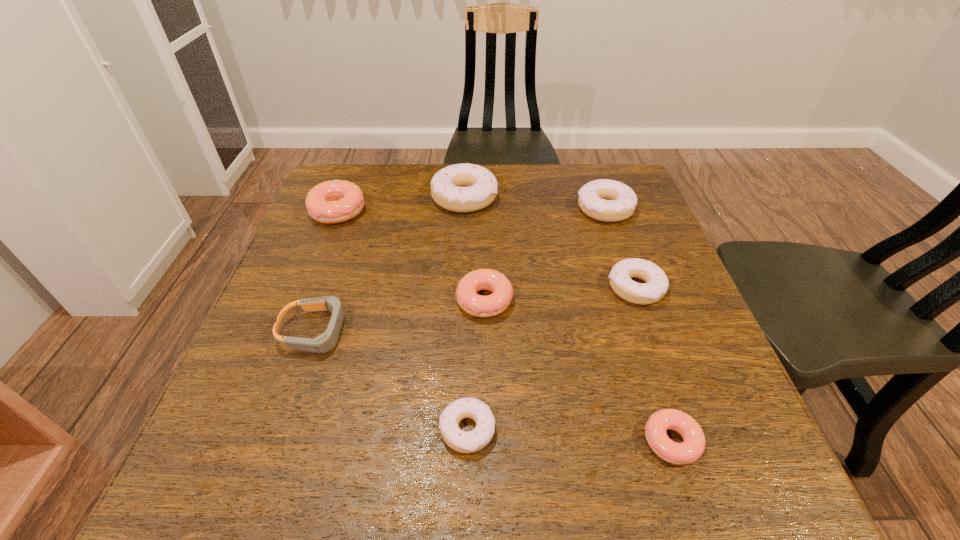
Locate which object is the second closest to the smallest pink doughnut. Please provide its 2D coordinates. Your answer should be formatted as a tuple, i.e. [(x, y)], where the tuple contains the x and y coordinates of a point satisfying the conditions above.

[(657, 283)]

Locate an element on the screen. Image resolution: width=960 pixels, height=540 pixels. object that is the fourth nearest to the leftmost pink doughnut is located at coordinates (465, 442).

Locate an element on the screen. The height and width of the screenshot is (540, 960). doughnut that stands as the fourth closest to the second smallest white doughnut is located at coordinates (463, 188).

Find the location of `doughnut that is the sixth closest to the rightmost pink doughnut`. doughnut that is the sixth closest to the rightmost pink doughnut is located at coordinates (335, 201).

Image resolution: width=960 pixels, height=540 pixels. In order to click on white doughnut that is the closest one to the goggles in this screenshot , I will do `click(465, 442)`.

You are a GUI agent. You are given a task and a screenshot of the screen. Output one action in this format:
    pyautogui.click(x=<x>, y=<y>)
    Task: Click on the white doughnut that stands as the third closest to the biggest white doughnut
    This screenshot has width=960, height=540.
    Given the screenshot: What is the action you would take?
    pyautogui.click(x=465, y=442)

Locate an element on the screen. The image size is (960, 540). the second closest pink doughnut relative to the nearest pink doughnut is located at coordinates (335, 201).

Locate which pink doughnut is the second closest to the nearest white doughnut. Please provide its 2D coordinates. Your answer should be formatted as a tuple, i.e. [(x, y)], where the tuple contains the x and y coordinates of a point satisfying the conditions above.

[(693, 445)]

Find the location of a particular element. vacant space that satisfies the following two spatial constraints: 1. on the front side of the biggest white doughnut; 2. on the right side of the second smallest white doughnut is located at coordinates (460, 288).

Where is `free spot that satisfies the following two spatial constraints: 1. on the front side of the biggest white doughnut; 2. on the left side of the smallest pink doughnut`? free spot that satisfies the following two spatial constraints: 1. on the front side of the biggest white doughnut; 2. on the left side of the smallest pink doughnut is located at coordinates (453, 441).